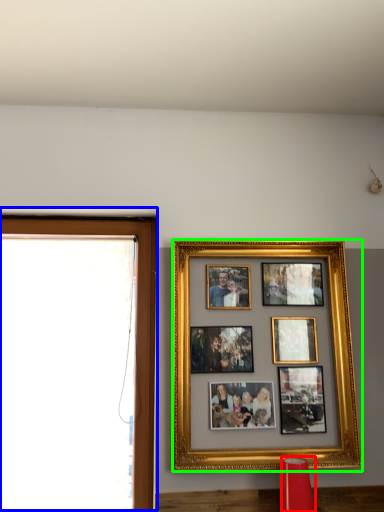
Question: Which object is the closest to the lamp (highlighted by a red box)? Choose among these: window frame (highlighted by a blue box) or picture frame (highlighted by a green box).

Choices:
 (A) window frame
 (B) picture frame

Answer: (B)